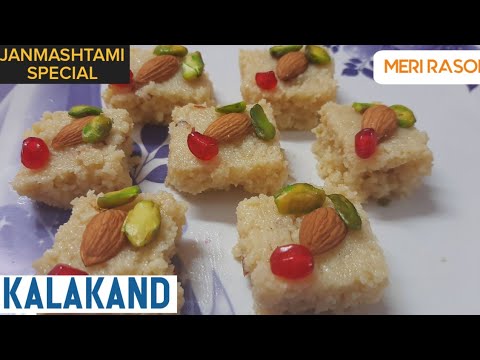
The height and width of the screenshot is (360, 480). Identify the location of plate. (440, 257).